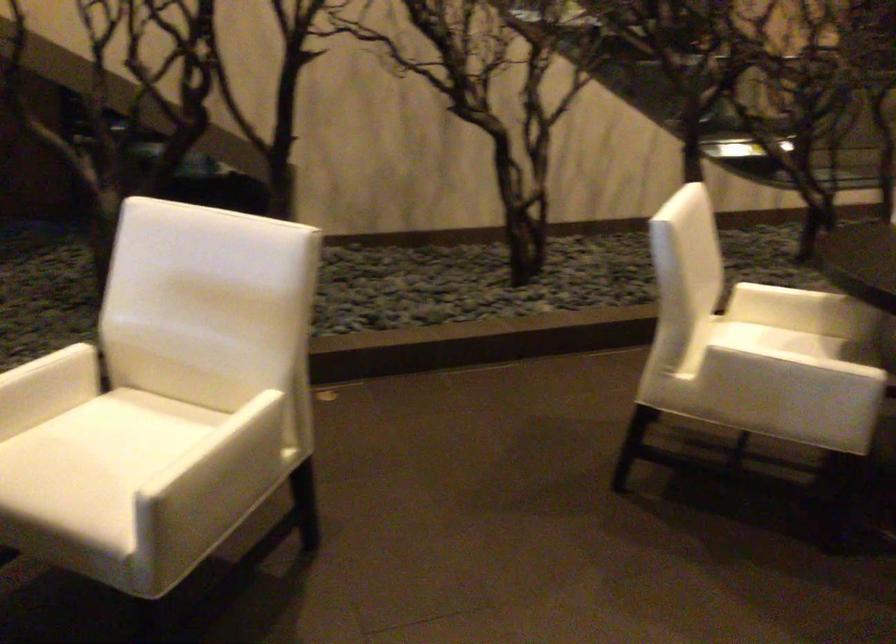
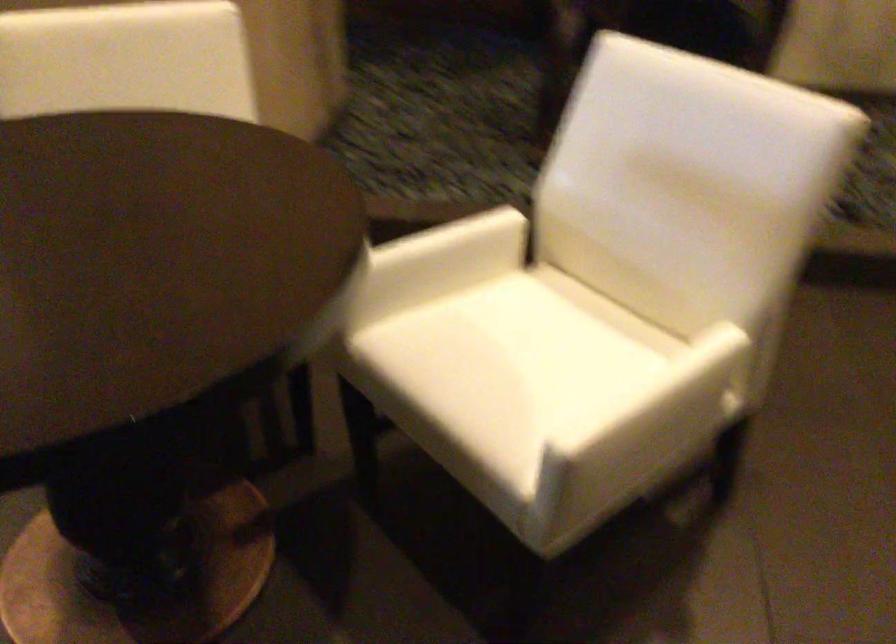
Find the pixel in the second image that matches the point at 240,451 in the first image.

(684, 402)